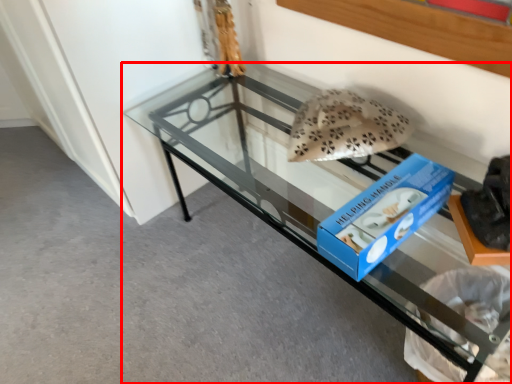
Question: Considering the relative positions of furniture (annotated by the red box) and stuff in the image provided, where is furniture (annotated by the red box) located with respect to the staircase?

Choices:
 (A) right
 (B) left

Answer: (B)